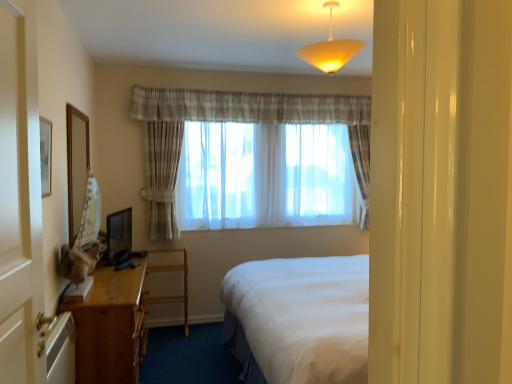
Question: Is wooden desk at left oriented towards sheer fabric curtains at center?

Choices:
 (A) no
 (B) yes

Answer: (A)

Question: Would you say wooden desk at left is a long distance from sheer fabric curtains at center?

Choices:
 (A) yes
 (B) no

Answer: (A)

Question: Does wooden desk at left have a lesser width compared to sheer fabric curtains at center?

Choices:
 (A) yes
 (B) no

Answer: (B)

Question: Can you confirm if wooden desk at left is bigger than sheer fabric curtains at center?

Choices:
 (A) no
 (B) yes

Answer: (A)

Question: Is wooden desk at left behind sheer fabric curtains at center?

Choices:
 (A) yes
 (B) no

Answer: (B)

Question: Is wooden desk at left positioned with its back to sheer fabric curtains at center?

Choices:
 (A) yes
 (B) no

Answer: (B)

Question: Does wooden mirror at left have a lesser width compared to white wood screen door at left?

Choices:
 (A) yes
 (B) no

Answer: (A)

Question: Does wooden mirror at left lie behind white wood screen door at left?

Choices:
 (A) yes
 (B) no

Answer: (A)

Question: Is wooden mirror at left directly adjacent to white wood screen door at left?

Choices:
 (A) yes
 (B) no

Answer: (B)

Question: Does wooden mirror at left appear on the left side of white wood screen door at left?

Choices:
 (A) no
 (B) yes

Answer: (B)

Question: Can you confirm if wooden mirror at left is wider than white wood screen door at left?

Choices:
 (A) no
 (B) yes

Answer: (A)

Question: Is wooden mirror at left positioned before white wood screen door at left?

Choices:
 (A) no
 (B) yes

Answer: (A)

Question: From the image's perspective, is wooden mirror at left on top of wooden desk at lower left?

Choices:
 (A) no
 (B) yes

Answer: (B)